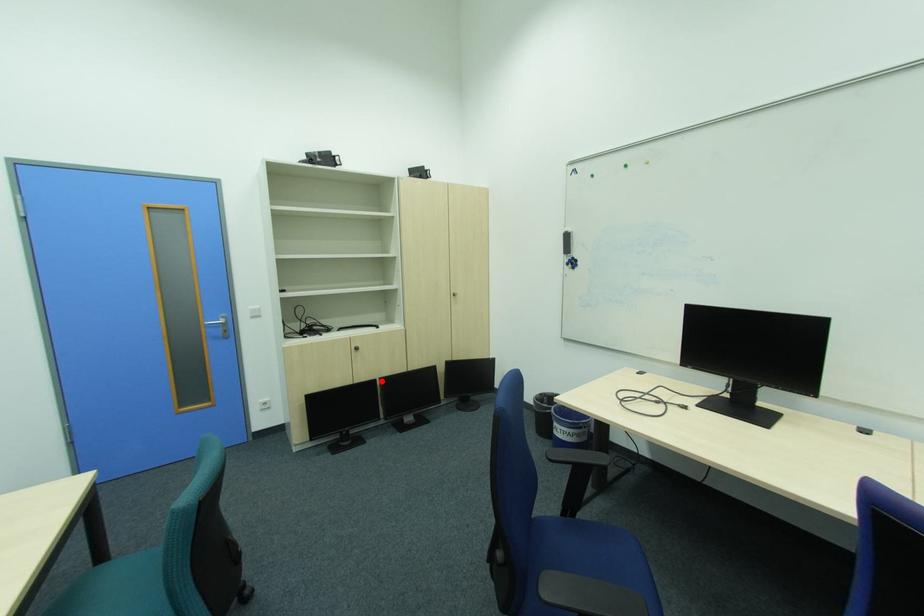
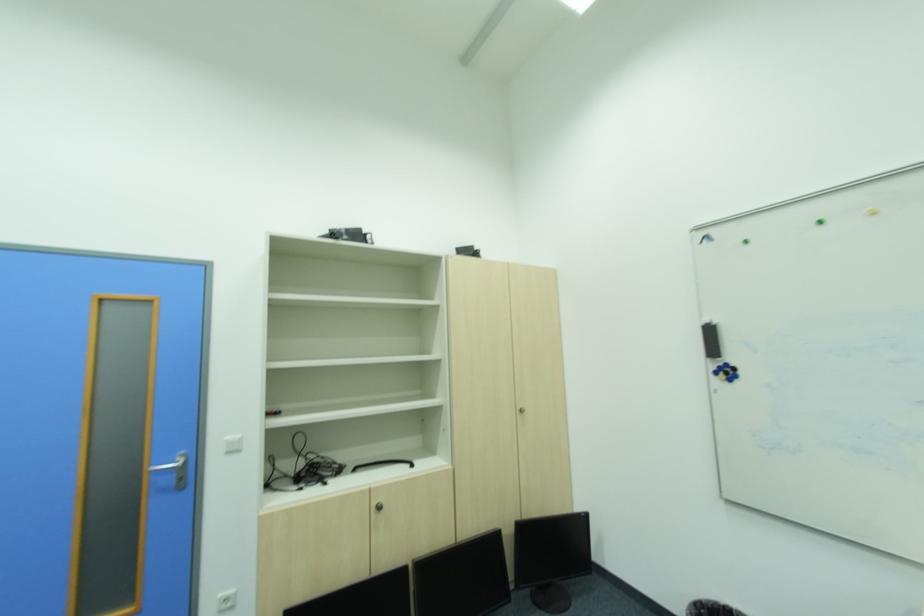
In the second image, find the point that corresponds to the highlighted location in the first image.

(411, 570)